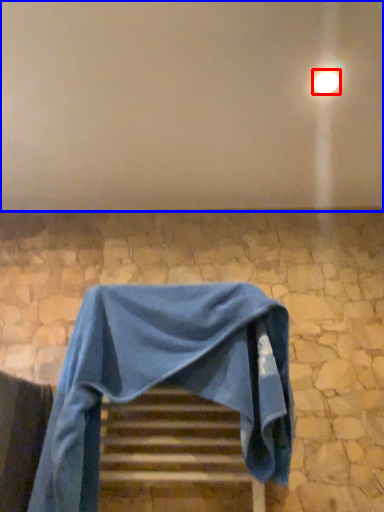
Question: Which of the following is the farthest to the observer, light (highlighted by a red box) or backdrop (highlighted by a blue box)?

Choices:
 (A) light
 (B) backdrop

Answer: (A)